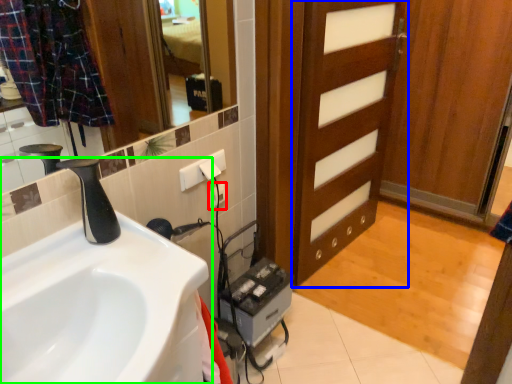
Question: Which object is the farthest from electric outlet (highlighted by a red box)? Choose among these: door (highlighted by a blue box) or sink (highlighted by a green box).

Choices:
 (A) door
 (B) sink

Answer: (A)